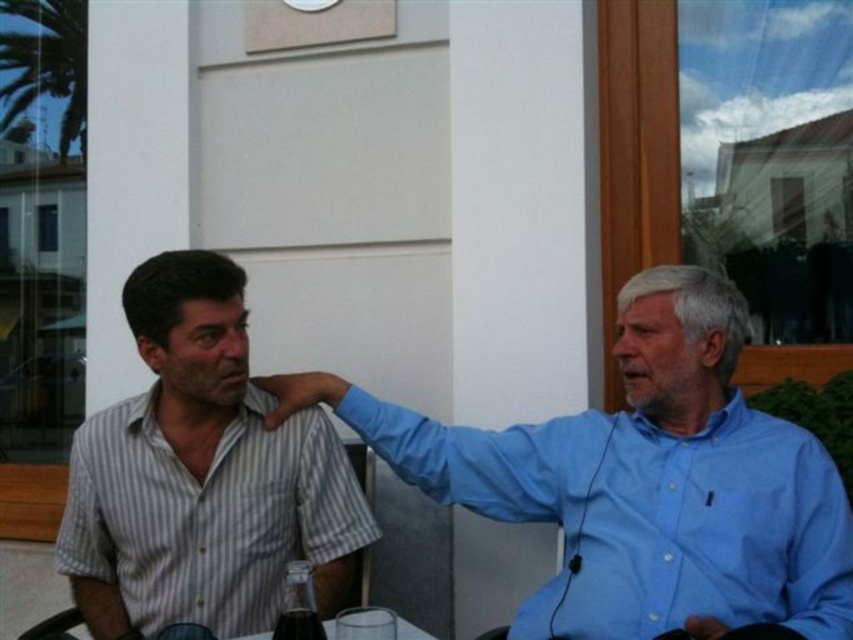
Question: Is striped cotton shirt at left to the left of translucent glass bottle at lower center from the viewer's perspective?

Choices:
 (A) no
 (B) yes

Answer: (B)

Question: Which of the following is the closest to the observer?

Choices:
 (A) translucent glass bottle at lower center
 (B) blue cotton shirt at right
 (C) clear glass table at center
 (D) striped cotton shirt at left

Answer: (A)

Question: Is translucent glass bottle at lower center below clear glass table at center?

Choices:
 (A) yes
 (B) no

Answer: (B)

Question: Which object appears farthest from the camera in this image?

Choices:
 (A) striped cotton shirt at left
 (B) translucent glass bottle at lower center
 (C) clear glass table at center

Answer: (A)

Question: Which object is closer to the camera taking this photo?

Choices:
 (A) blue cotton shirt at right
 (B) striped cotton shirt at left

Answer: (A)

Question: Can you confirm if blue cotton shirt at right is bigger than clear glass table at center?

Choices:
 (A) yes
 (B) no

Answer: (A)